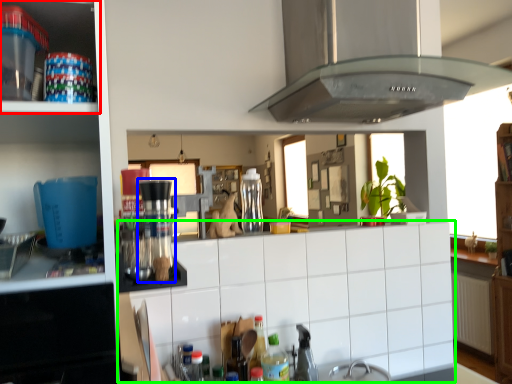
Question: Considering the real-world distances, which object is farthest from cabinetry (highlighted by a red box)? coffee machine (highlighted by a blue box) or counter top (highlighted by a green box)?

Choices:
 (A) coffee machine
 (B) counter top

Answer: (B)